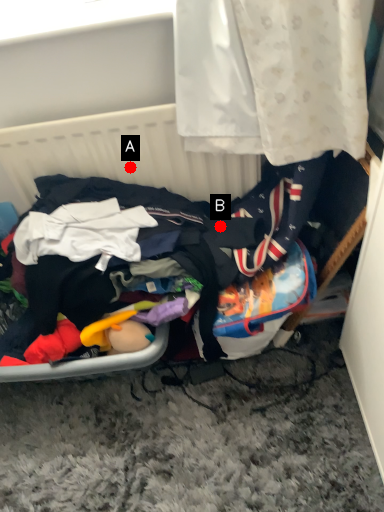
Question: Two points are circled on the image, labeled by A and B beside each circle. Which point is closer to the camera?

Choices:
 (A) A is closer
 (B) B is closer

Answer: (B)